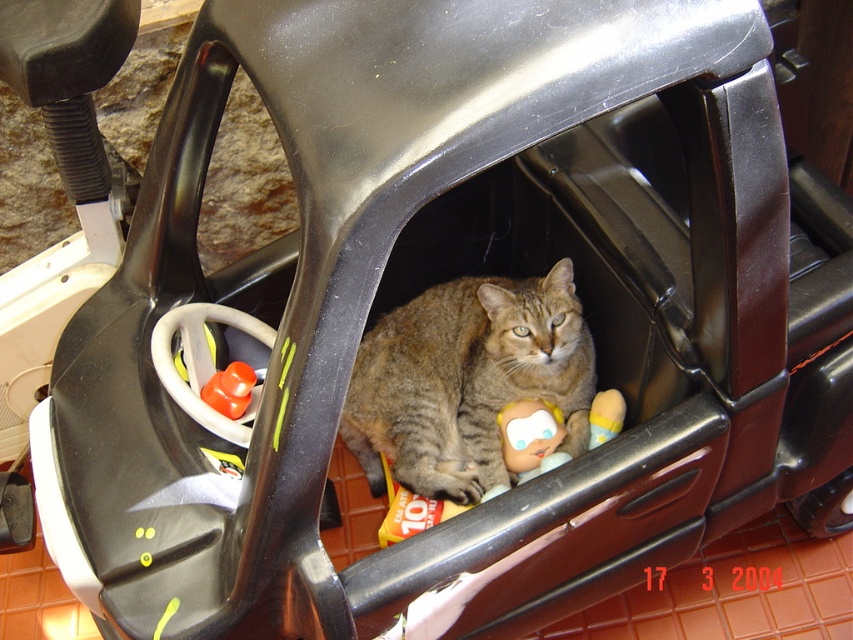
Question: Is rubberized orange cup at center thinner than smooth plastic doll at center?

Choices:
 (A) no
 (B) yes

Answer: (A)

Question: Which object appears closest to the camera in this image?

Choices:
 (A) plastic baby doll at center
 (B) rubberized orange cup at center
 (C) smooth plastic doll at center

Answer: (B)

Question: Can you confirm if gray striped fur cat at center is positioned to the left of plastic baby doll at center?

Choices:
 (A) no
 (B) yes

Answer: (B)

Question: Does gray striped fur cat at center appear on the left side of rubberized orange cup at center?

Choices:
 (A) no
 (B) yes

Answer: (A)

Question: Among these points, which one is nearest to the camera?

Choices:
 (A) (225, 380)
 (B) (457, 317)
 (C) (607, 396)
 (D) (540, 442)

Answer: (A)

Question: Among these points, which one is nearest to the camera?

Choices:
 (A) (547, 408)
 (B) (531, 364)
 (C) (590, 436)
 (D) (210, 381)

Answer: (D)